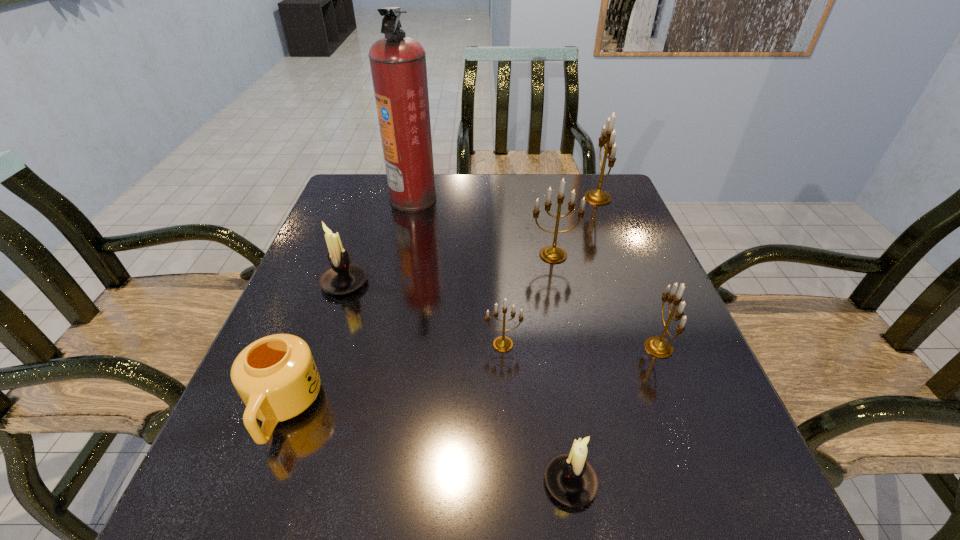
Locate an element on the screen. This screenshot has width=960, height=540. the nearest object is located at coordinates (571, 480).

Find the location of `the fifth candelabrum from right to left`. the fifth candelabrum from right to left is located at coordinates (502, 343).

Image resolution: width=960 pixels, height=540 pixels. Identify the location of the smallest gold candelabrum. (502, 343).

The height and width of the screenshot is (540, 960). Identify the location of the seventh farthest object. (276, 377).

The width and height of the screenshot is (960, 540). I want to click on free spot located 0.170m at the nozzle of the tallest object, so click(x=495, y=198).

Locate an element on the screen. vacant point located on the left of the tallest candelabrum is located at coordinates (528, 198).

I want to click on free region located on the right of the second tallest candelabrum, so click(652, 255).

Find the location of `vacant space located 0.340m on the back of the farther white candle holder`. vacant space located 0.340m on the back of the farther white candle holder is located at coordinates (375, 194).

Where is `free region located 0.200m on the front of the second smallest gold candelabrum`? This screenshot has width=960, height=540. free region located 0.200m on the front of the second smallest gold candelabrum is located at coordinates (708, 474).

Identify the location of free spot located on the left of the nearest candelabrum. Image resolution: width=960 pixels, height=540 pixels. (338, 483).